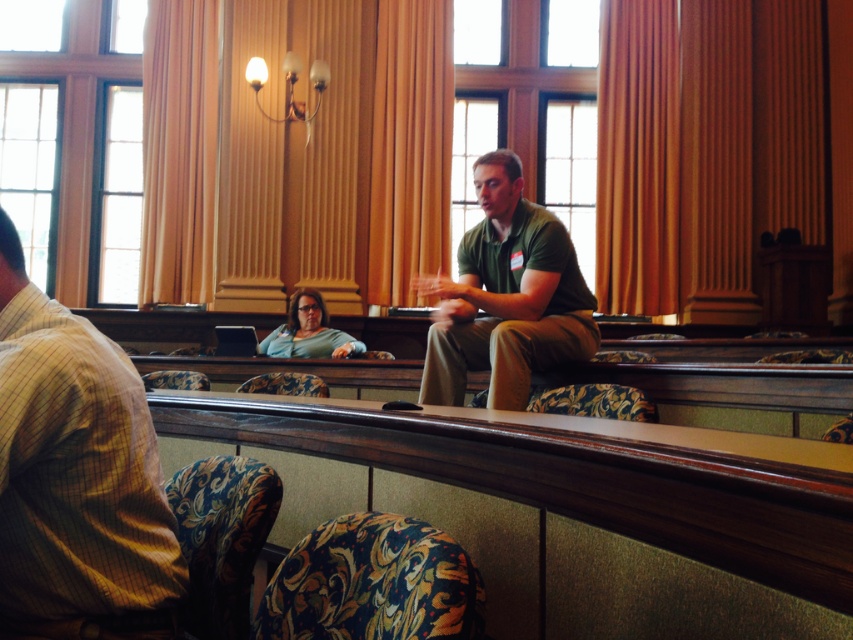
Question: Does wooden table at center have a greater width compared to matte green shirt at center?

Choices:
 (A) yes
 (B) no

Answer: (A)

Question: Can you confirm if wooden table at center is positioned below yellow striped shirt at left?

Choices:
 (A) yes
 (B) no

Answer: (A)

Question: Which point appears farthest from the camera in this image?

Choices:
 (A) (312, 419)
 (B) (560, 237)
 (C) (62, 413)

Answer: (B)

Question: Is wooden table at center further to camera compared to green matte shirt at center?

Choices:
 (A) no
 (B) yes

Answer: (A)

Question: Among these points, which one is farthest from the camera?

Choices:
 (A) (314, 310)
 (B) (32, 433)
 (C) (260, 401)
 (D) (503, 248)

Answer: (A)

Question: Which object appears closest to the camera in this image?

Choices:
 (A) yellow striped shirt at left
 (B) matte green shirt at center
 (C) green matte shirt at center

Answer: (A)